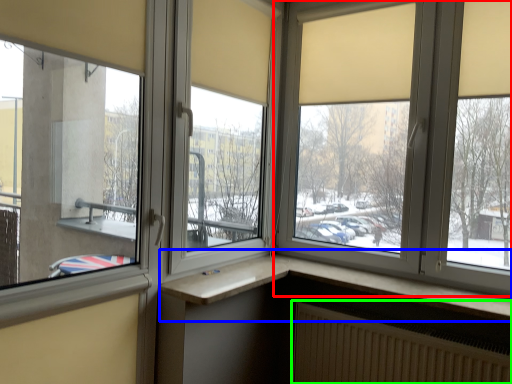
Question: Estimate the real-world distances between objects in this image. Which object is closer to window (highlighted by a red box), window (highlighted by a blue box) or radiator (highlighted by a green box)?

Choices:
 (A) window
 (B) radiator

Answer: (A)